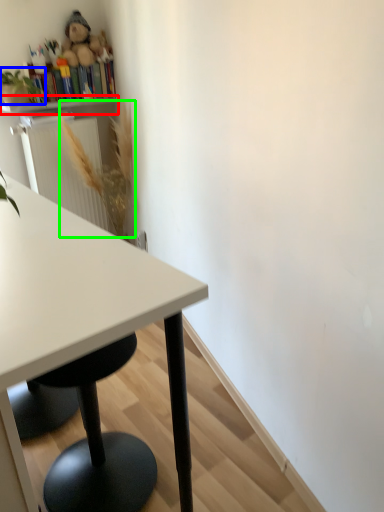
Question: Which object is positioned closest to shelf (highlighted by a red box)? Select from plant (highlighted by a blue box) and flower (highlighted by a green box).

Choices:
 (A) plant
 (B) flower

Answer: (A)